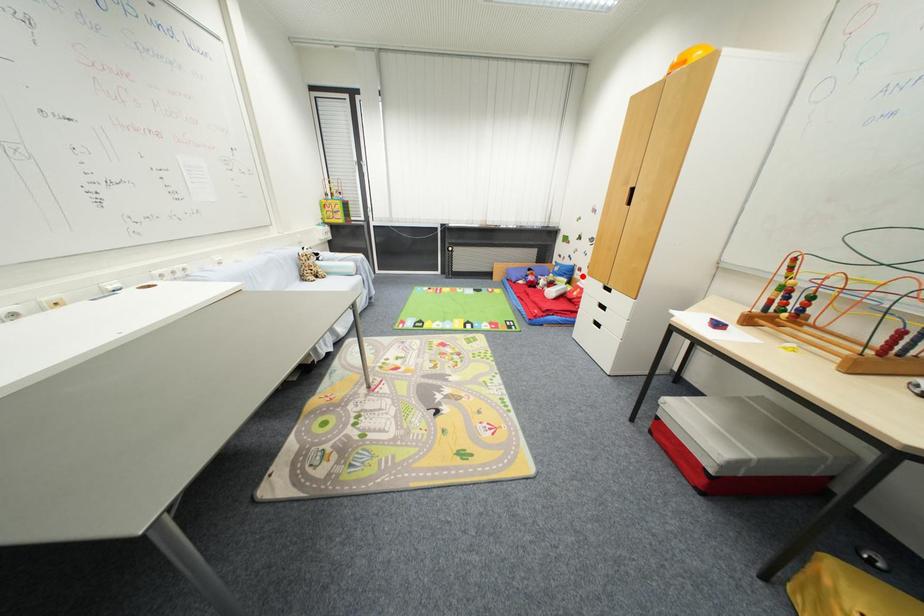
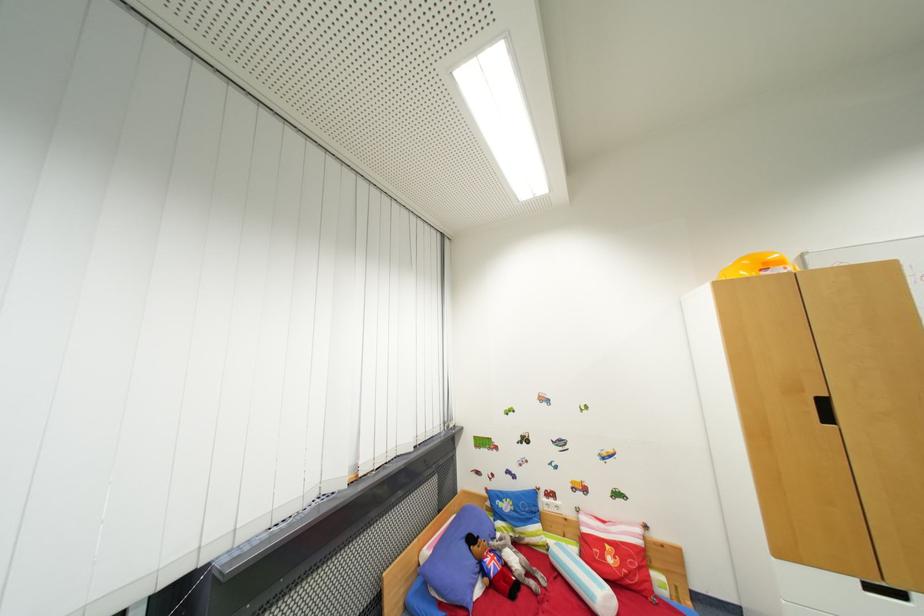
Question: I am providing you with two images of the same scene from different viewpoints. Image1 has a red point marked. In image2, the corresponding 3D location appears at what relative position? Reply with the corresponding letter.

Choices:
 (A) Closer
 (B) Farther

Answer: (B)